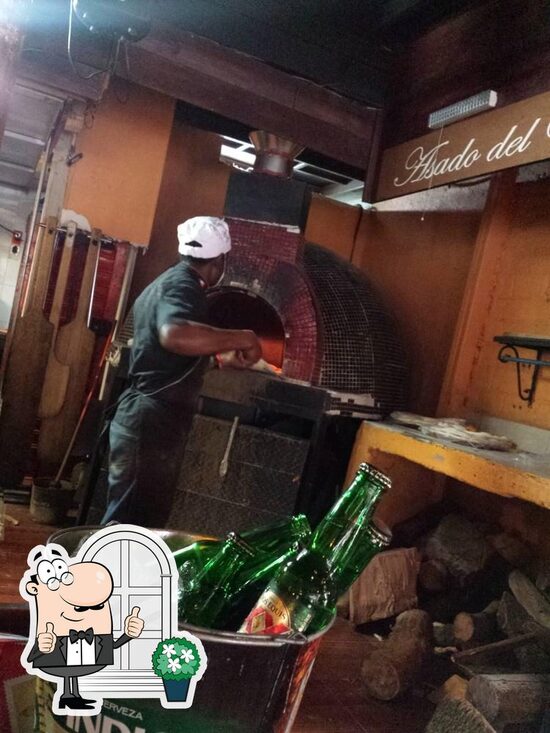
Identify the location of 4 green bottles. This screenshot has height=733, width=550. (291, 614), (212, 578), (368, 563), (284, 517).